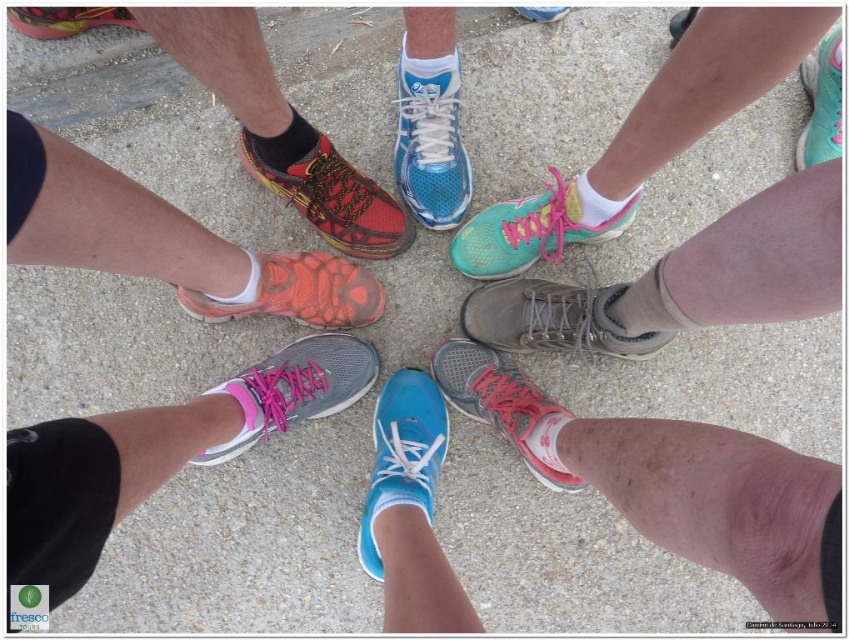
Between blue mesh shoe at center and shiny red running shoe at center, which one appears on the left side from the viewer's perspective?

shiny red running shoe at center

You are a GUI agent. You are given a task and a screenshot of the screen. Output one action in this format:
    pyautogui.click(x=<x>, y=<y>)
    Task: Click on the blue mesh shoe at center
    The height and width of the screenshot is (640, 849).
    Given the screenshot: What is the action you would take?
    pyautogui.click(x=430, y=140)

Is matte blue sneaker at center smaller than shiny red running shoe at center?

Incorrect, matte blue sneaker at center is not smaller in size than shiny red running shoe at center.

Between point (370, 506) and point (302, 179), which one is positioned in front?

Point (370, 506) is more forward.

I want to click on matte blue sneaker at center, so click(x=402, y=456).

Which is more to the right, matte blue sneaker at center or shiny gray sneaker at center?

Positioned to the right is shiny gray sneaker at center.

Who is more distant from viewer, (360, 518) or (543, 476)?

Positioned behind is point (360, 518).

Is point (400, 452) behind point (541, 397)?

No.

You are a GUI agent. You are given a task and a screenshot of the screen. Output one action in this format:
    pyautogui.click(x=<x>, y=<y>)
    Task: Click on the matte blue sneaker at center
    The height and width of the screenshot is (640, 849).
    Given the screenshot: What is the action you would take?
    pyautogui.click(x=402, y=456)